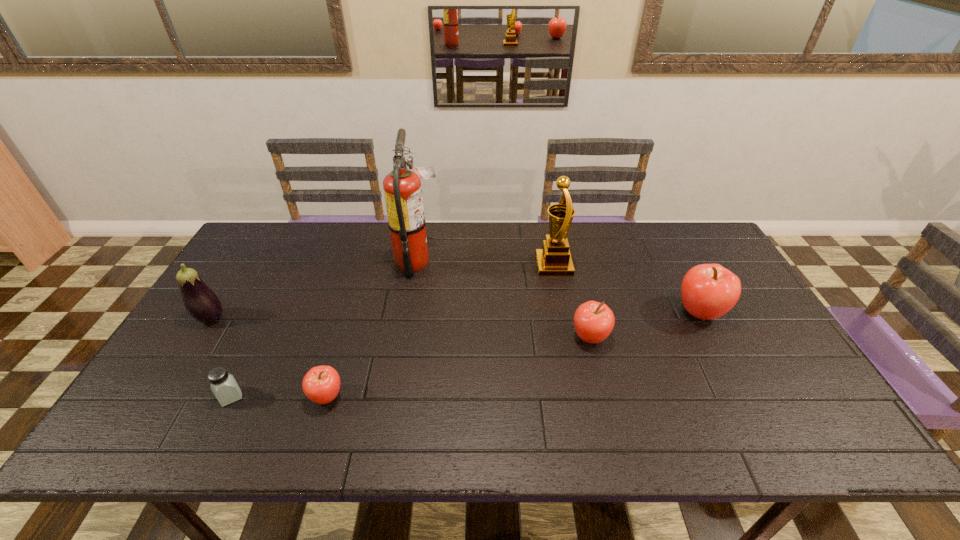
This screenshot has width=960, height=540. I want to click on free location that satisfies the following two spatial constraints: 1. from the nozzle of the rightmost apple; 2. on the left side of the fourth object from left to right, so click(409, 313).

The width and height of the screenshot is (960, 540). Identify the location of blank area in the image that satisfies the following two spatial constraints: 1. on the back side of the rightmost apple; 2. on the front-facing side of the award. (675, 266).